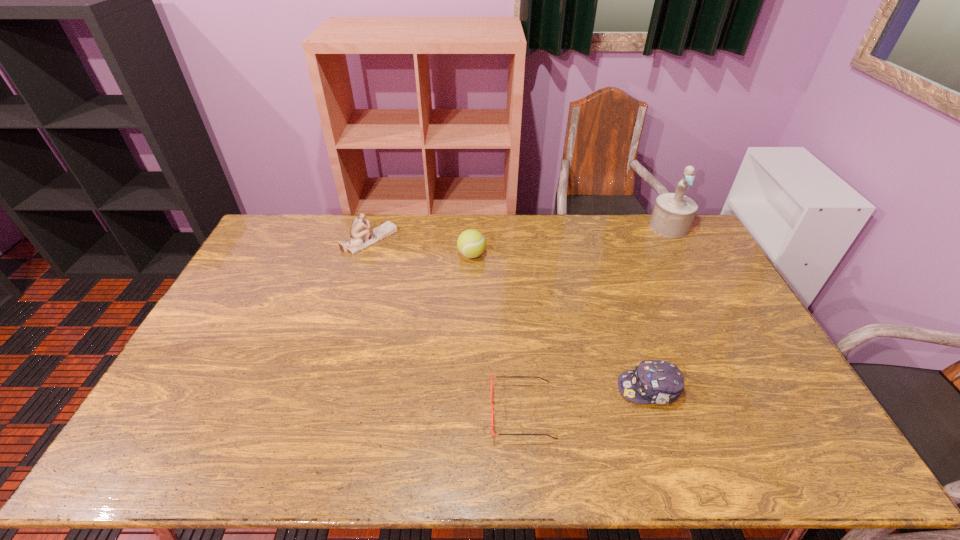
What are the coordinates of `unoccupied area between the leftmost object and the fourth object from left to right` in the screenshot? It's located at (510, 314).

Locate an element on the screen. This screenshot has width=960, height=540. object identified as the third closest to the shorter figurine is located at coordinates (653, 381).

Locate which object ranks third in proximity to the tallest object. Please provide its 2D coordinates. Your answer should be formatted as a tuple, i.e. [(x, y)], where the tuple contains the x and y coordinates of a point satisfying the conditions above.

[(492, 408)]

The height and width of the screenshot is (540, 960). I want to click on free space that satisfies the following two spatial constraints: 1. on the front-facing side of the third tallest object; 2. on the left side of the left figurine, so click(x=366, y=255).

Image resolution: width=960 pixels, height=540 pixels. Find the location of `free point that satisfies the following two spatial constraints: 1. at the beak of the rightmost object; 2. on the front-facing side of the shorter figurine`. free point that satisfies the following two spatial constraints: 1. at the beak of the rightmost object; 2. on the front-facing side of the shorter figurine is located at coordinates (676, 239).

The image size is (960, 540). I want to click on free space that satisfies the following two spatial constraints: 1. on the front-facing side of the third shortest object; 2. on the left side of the left figurine, so click(x=366, y=255).